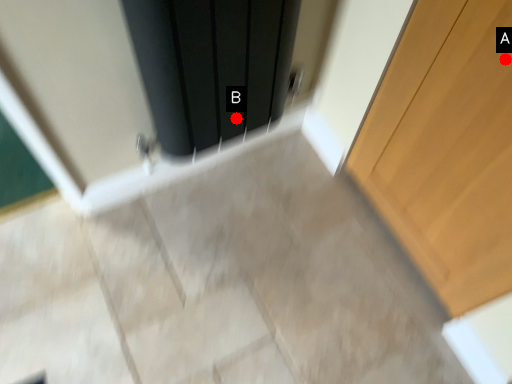
Question: Two points are circled on the image, labeled by A and B beside each circle. Which point is closer to the camera?

Choices:
 (A) A is closer
 (B) B is closer

Answer: (A)